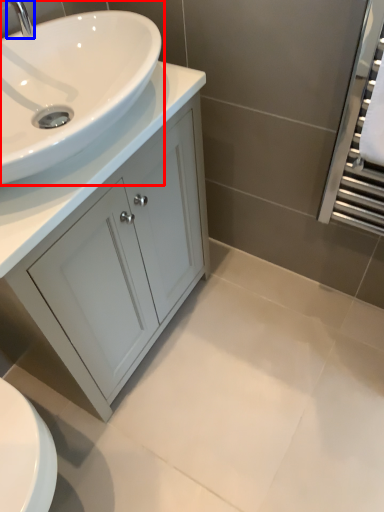
Question: Which point is closer to the camera, sink (highlighted by a red box) or tap (highlighted by a blue box)?

Choices:
 (A) sink
 (B) tap

Answer: (A)